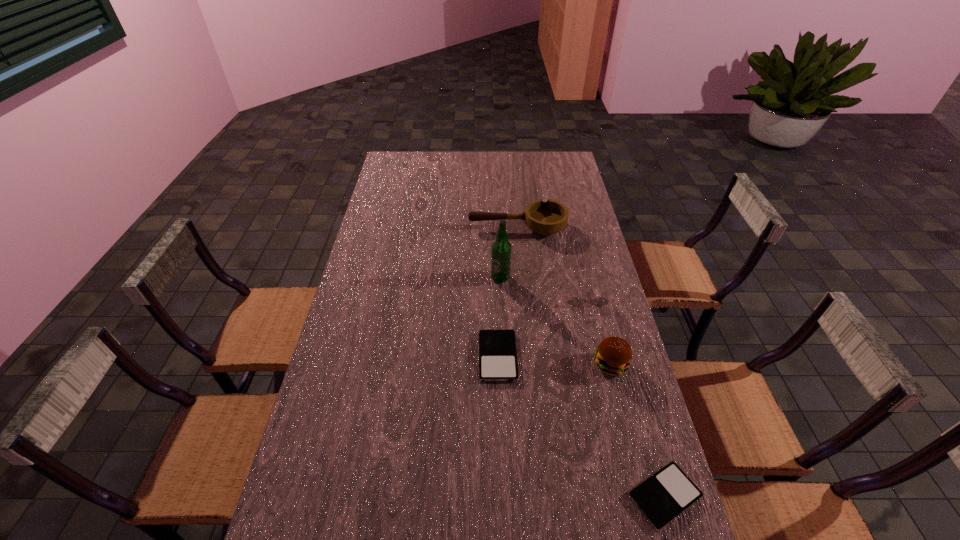
The width and height of the screenshot is (960, 540). I want to click on iPod located at the right edge, so click(662, 497).

I want to click on sunglasses situated at the right edge, so [x=577, y=301].

At what (x,y) coordinates should I click in order to perform the action: click on saucepan positioned at the right edge. Please return your answer as a coordinate pair (x, y). Looking at the image, I should click on (548, 218).

This screenshot has height=540, width=960. I want to click on hamburger that is at the right edge, so click(613, 356).

This screenshot has height=540, width=960. I want to click on object present at the near right corner, so click(x=662, y=497).

The image size is (960, 540). In the image, there is a desktop. In order to click on vacant space at the far edge in this screenshot , I will do `click(462, 156)`.

The height and width of the screenshot is (540, 960). In the image, there is a desktop. Find the location of `vacant space at the near edge`. vacant space at the near edge is located at coordinates (409, 512).

You are a GUI agent. You are given a task and a screenshot of the screen. Output one action in this format:
    pyautogui.click(x=<x>, y=<y>)
    Task: Click on the free spot at the left edge of the desktop
    This screenshot has height=540, width=960.
    Given the screenshot: What is the action you would take?
    [401, 241]

This screenshot has height=540, width=960. I want to click on free space at the right edge of the desktop, so click(x=611, y=298).

In the image, there is a desktop. At what (x,y) coordinates should I click in order to perform the action: click on vacant space at the near left corner. Please return your answer as a coordinate pair (x, y). This screenshot has height=540, width=960. Looking at the image, I should click on (338, 532).